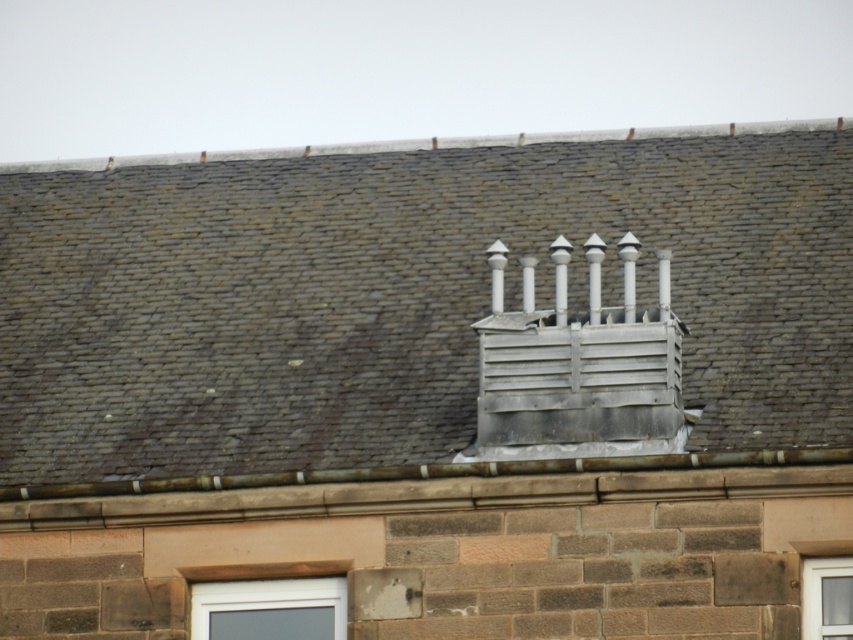
You are standing in front of the building and notice two windows. The white plastic window at lower center and the clear glass window at center. Which window is located to the left of the other?

The white plastic window at lower center is positioned on the left side of clear glass window at center.

Based on the photo, you are standing on the ground looking at the roof. Which of the two points, point (601, 321) or point (816, 572), is closer to you?

Point (601, 321) is closer to you because it is further to the viewer than point (816, 572).

You are a window installer assessing the roof. The metallic gray vent at center and the clear glass window at center are both on the roof. Which object is wider?

The metallic gray vent at center might be wider than clear glass window at center according to the description.